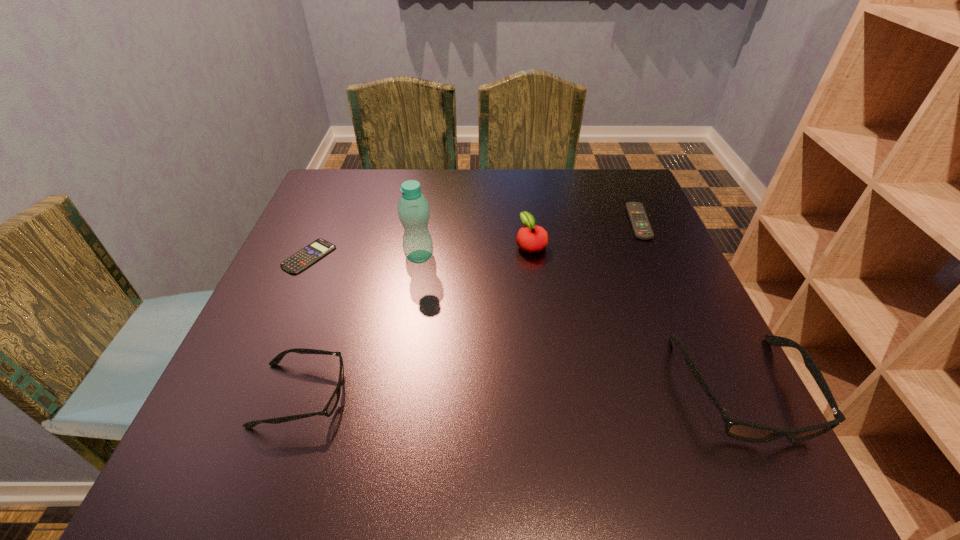
At what (x,y) coordinates should I click in order to perform the action: click on vacant space located 0.160m on the back of the calculator. Please return your answer as a coordinate pair (x, y). Image resolution: width=960 pixels, height=540 pixels. Looking at the image, I should click on (332, 202).

This screenshot has width=960, height=540. I want to click on free space located on the right of the apple, so click(x=588, y=244).

Where is `vacant region located 0.050m on the back of the fourth object from right to left`? vacant region located 0.050m on the back of the fourth object from right to left is located at coordinates (422, 234).

The image size is (960, 540). Identify the location of object that is at the far edge. (639, 221).

Locate an element on the screen. Image resolution: width=960 pixels, height=540 pixels. spectacles that is at the left edge is located at coordinates (330, 407).

Find the location of a particular element. calculator at the left edge is located at coordinates (305, 257).

Locate an element on the screen. spectacles at the right edge is located at coordinates (738, 429).

Locate an element on the screen. The height and width of the screenshot is (540, 960). remote control situated at the right edge is located at coordinates (639, 221).

The height and width of the screenshot is (540, 960). I want to click on object that is at the near left corner, so click(x=330, y=407).

The height and width of the screenshot is (540, 960). I want to click on object at the far right corner, so click(x=639, y=221).